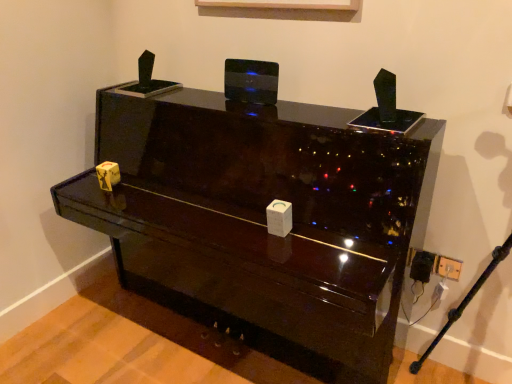
Question: Are glossy black piano at center and white plastic electric outlet at lower right located far from each other?

Choices:
 (A) yes
 (B) no

Answer: (B)

Question: Considering the relative sizes of glossy black piano at center and white plastic electric outlet at lower right in the image provided, is glossy black piano at center wider than white plastic electric outlet at lower right?

Choices:
 (A) no
 (B) yes

Answer: (B)

Question: Is the position of glossy black piano at center more distant than that of white plastic electric outlet at lower right?

Choices:
 (A) no
 (B) yes

Answer: (A)

Question: Is glossy black piano at center not inside white plastic electric outlet at lower right?

Choices:
 (A) no
 (B) yes

Answer: (B)

Question: From a real-world perspective, does glossy black piano at center stand above white plastic electric outlet at lower right?

Choices:
 (A) no
 (B) yes

Answer: (B)

Question: Considering the relative sizes of glossy black piano at center and white plastic electric outlet at lower right in the image provided, is glossy black piano at center taller than white plastic electric outlet at lower right?

Choices:
 (A) no
 (B) yes

Answer: (B)

Question: From a real-world perspective, is white plastic electric outlet at lower right located beneath glossy black piano at center?

Choices:
 (A) yes
 (B) no

Answer: (A)

Question: Is white plastic electric outlet at lower right facing away from glossy black piano at center?

Choices:
 (A) no
 (B) yes

Answer: (A)

Question: Considering the relative sizes of white plastic electric outlet at lower right and glossy black piano at center in the image provided, is white plastic electric outlet at lower right thinner than glossy black piano at center?

Choices:
 (A) no
 (B) yes

Answer: (B)

Question: Are white plastic electric outlet at lower right and glossy black piano at center located far from each other?

Choices:
 (A) no
 (B) yes

Answer: (A)

Question: From the image's perspective, is white plastic electric outlet at lower right below glossy black piano at center?

Choices:
 (A) yes
 (B) no

Answer: (A)

Question: Is white plastic electric outlet at lower right positioned before glossy black piano at center?

Choices:
 (A) no
 (B) yes

Answer: (A)

Question: Considering the relative positions of glossy black piano at center and white plastic electric outlet at lower right in the image provided, is glossy black piano at center to the left or to the right of white plastic electric outlet at lower right?

Choices:
 (A) left
 (B) right

Answer: (A)